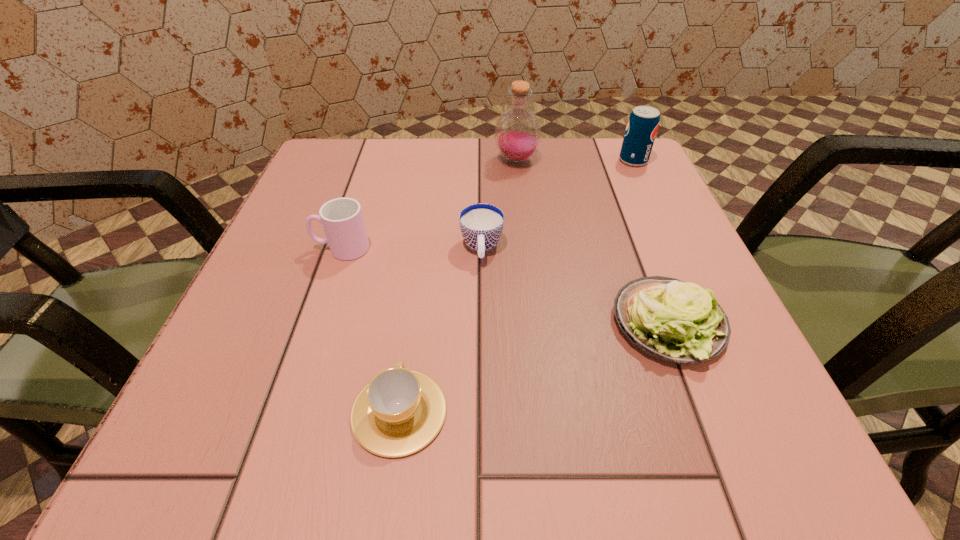
You are a GUI agent. You are given a task and a screenshot of the screen. Output one action in this format:
    pyautogui.click(x=<x>, y=<y>)
    Task: Click on the object positioned at the left edge
    The height and width of the screenshot is (540, 960).
    Given the screenshot: What is the action you would take?
    pyautogui.click(x=342, y=219)

Identify the location of pop located at the right edge. Image resolution: width=960 pixels, height=540 pixels. (643, 122).

Image resolution: width=960 pixels, height=540 pixels. What are the coordinates of `lettuce present at the right edge` in the screenshot? It's located at (671, 320).

Where is `object positioned at the far right corner`? This screenshot has height=540, width=960. object positioned at the far right corner is located at coordinates (643, 122).

This screenshot has width=960, height=540. In order to click on vacant space at the far edge of the desktop in this screenshot , I will do `click(382, 191)`.

You are a GUI agent. You are given a task and a screenshot of the screen. Output one action in this format:
    pyautogui.click(x=<x>, y=<y>)
    Task: Click on the vacant point at the near edge
    Image resolution: width=960 pixels, height=540 pixels.
    Given the screenshot: What is the action you would take?
    pyautogui.click(x=600, y=470)

In order to click on vacant space at the left edge in this screenshot , I will do `click(358, 201)`.

Where is `free spot at the right edge of the desktop`? This screenshot has width=960, height=540. free spot at the right edge of the desktop is located at coordinates pyautogui.click(x=622, y=258).

The height and width of the screenshot is (540, 960). I want to click on free space at the far left corner of the desktop, so click(344, 139).

This screenshot has height=540, width=960. In the image, there is a desktop. Identify the location of blank space at the far right corner. (586, 169).